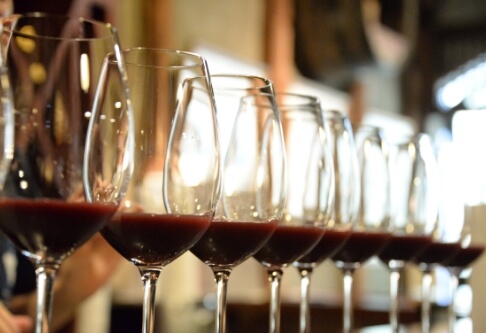
Where is `wine glasses`? wine glasses is located at coordinates (476, 256), (433, 257), (399, 255), (360, 255), (329, 247), (289, 246), (235, 242), (156, 242), (68, 226).